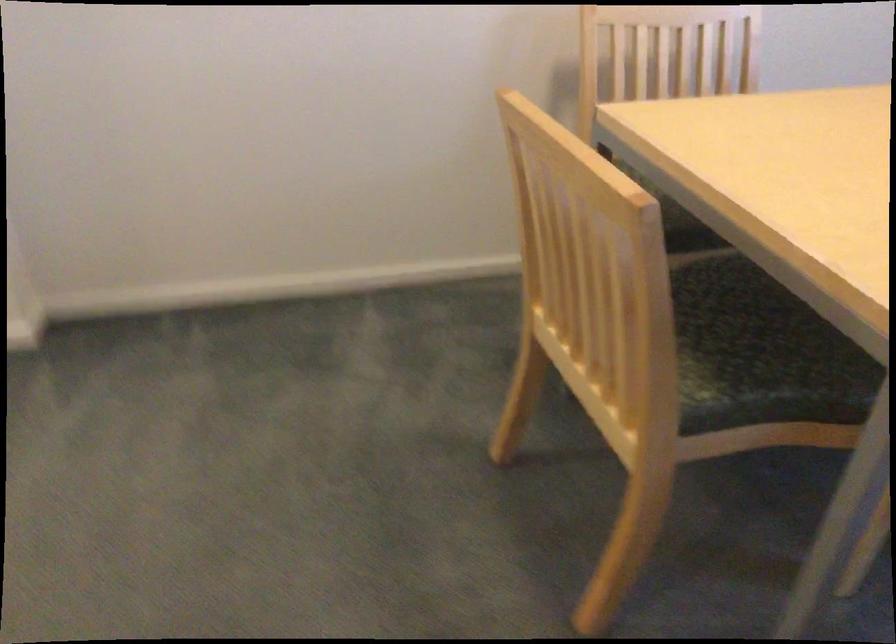
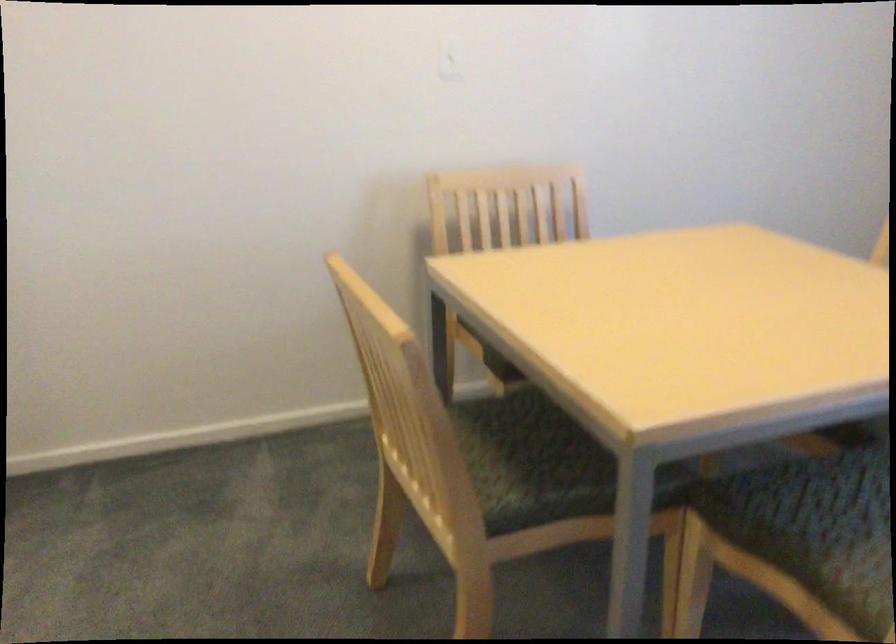
The point at (719, 354) is marked in the first image. Where is the corresponding point in the second image?

(530, 462)